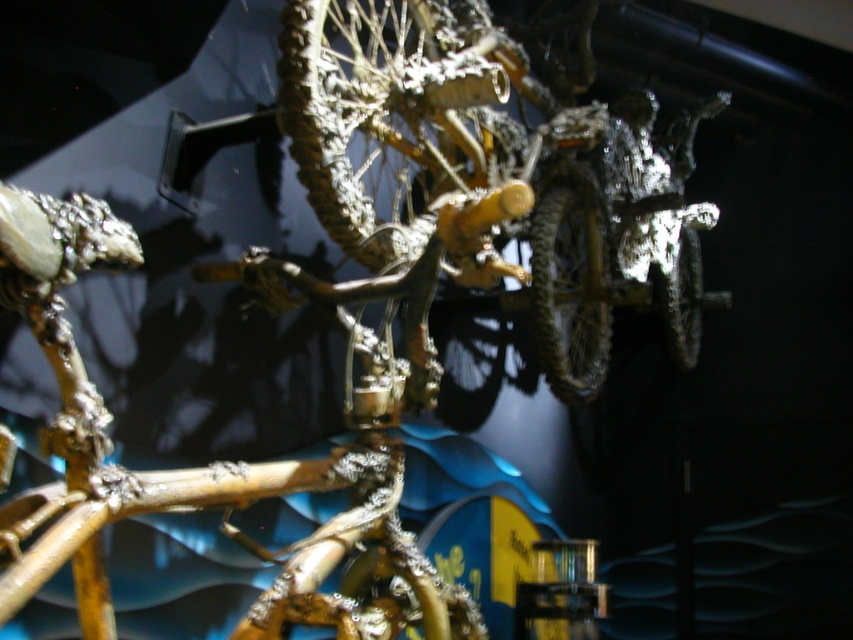
You are an art curator examining the sculpture. You notice the metallic gold tire at center and the metallic silver tire at right. Which of these two tires is positioned lower in the sculpture?

The metallic gold tire at center is positioned lower than the metallic silver tire at right because it is located below it.

Based on the photo, you are an art restorer examining the metallic sculpture. You notice two points on the sculpture labeled as point 1 and point 2. The coordinates for point 1 are at (602, 376) and point 2 at (692, 273). From your vantage point, which point appears closer to you?

Point 1 at (602, 376) is closer to the camera than point 2 at (692, 273).